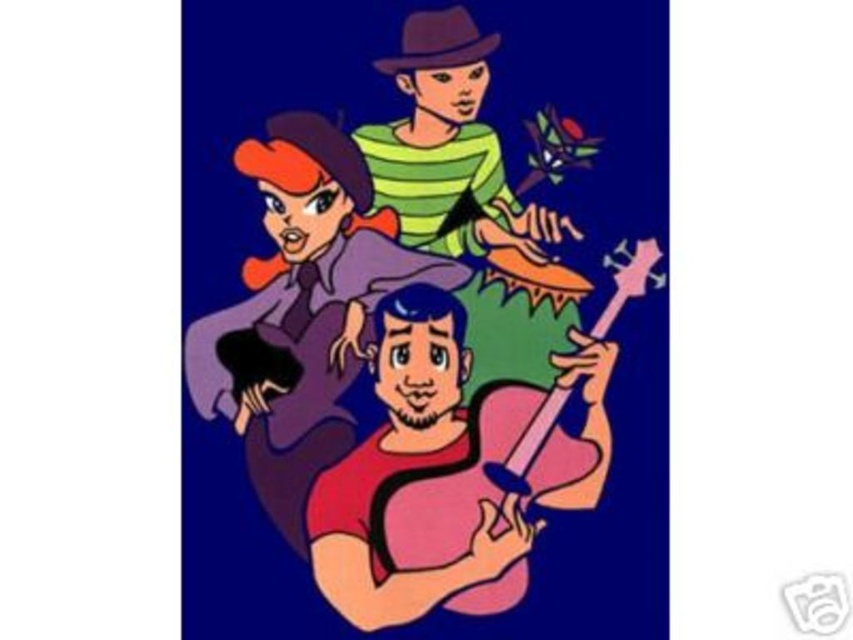
Between pink matte guitar at center and smooth purple dress at center, which one has less height?

pink matte guitar at center is shorter.

Between point (581, 452) and point (312, 259), which one is positioned behind?

Positioned behind is point (312, 259).

This screenshot has width=853, height=640. I want to click on pink matte guitar at center, so click(x=424, y=476).

Is point (505, 540) farther from camera compared to point (485, 177)?

No, (505, 540) is closer to viewer.

Where is `pink matte guitar at center`? The height and width of the screenshot is (640, 853). pink matte guitar at center is located at coordinates (424, 476).

Is point (316, 563) positioned in front of point (544, 257)?

Yes, point (316, 563) is closer to viewer.

I want to click on pink matte guitar at center, so click(x=424, y=476).

Where is `smooth purple dress at center`? smooth purple dress at center is located at coordinates click(x=300, y=308).

What do you see at coordinates (300, 308) in the screenshot? The image size is (853, 640). I see `smooth purple dress at center` at bounding box center [300, 308].

At what (x,y) coordinates should I click in order to perform the action: click on smooth purple dress at center. Please return your answer as a coordinate pair (x, y). Looking at the image, I should click on (300, 308).